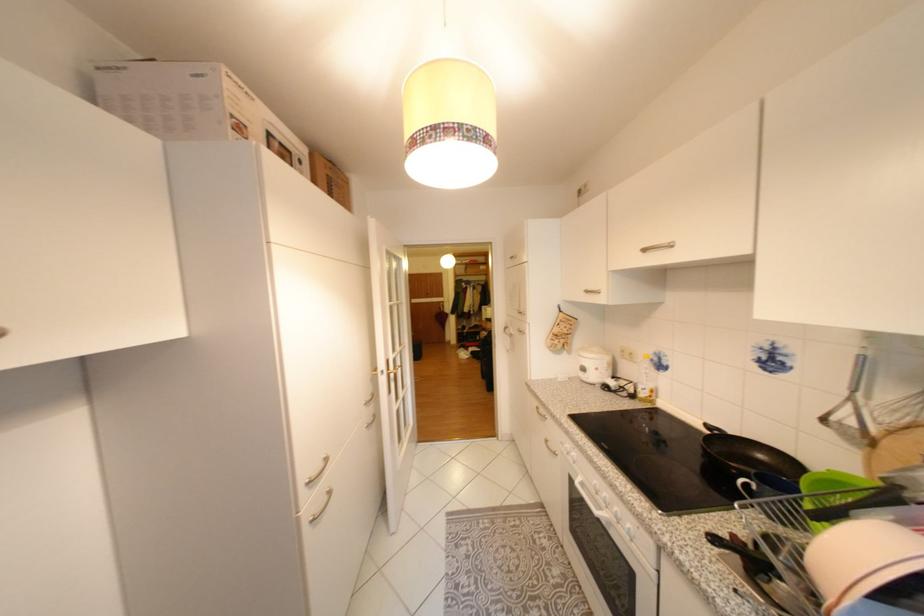
Which object does [647,381] point to?

It corresponds to the plastic oil bottle in the image.